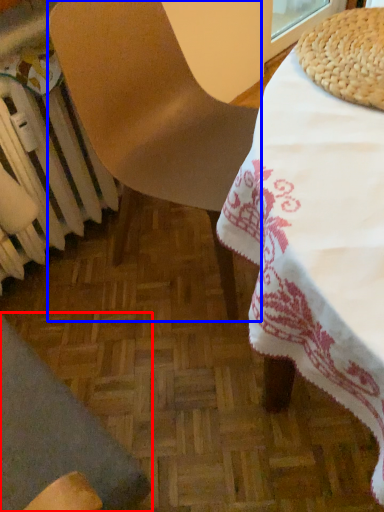
Question: Which point is closer to the camera, chair (highlighted by a red box) or chair (highlighted by a blue box)?

Choices:
 (A) chair
 (B) chair

Answer: (A)